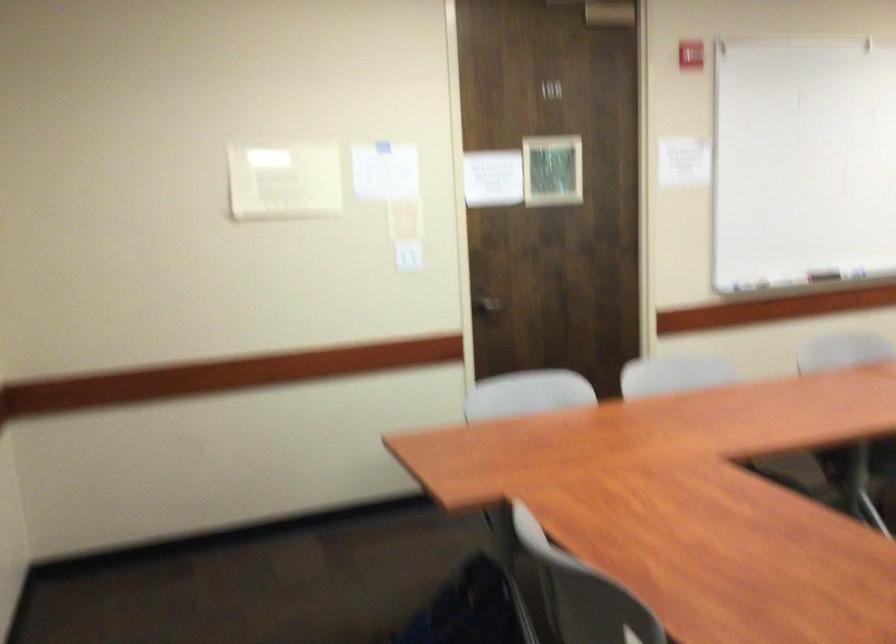
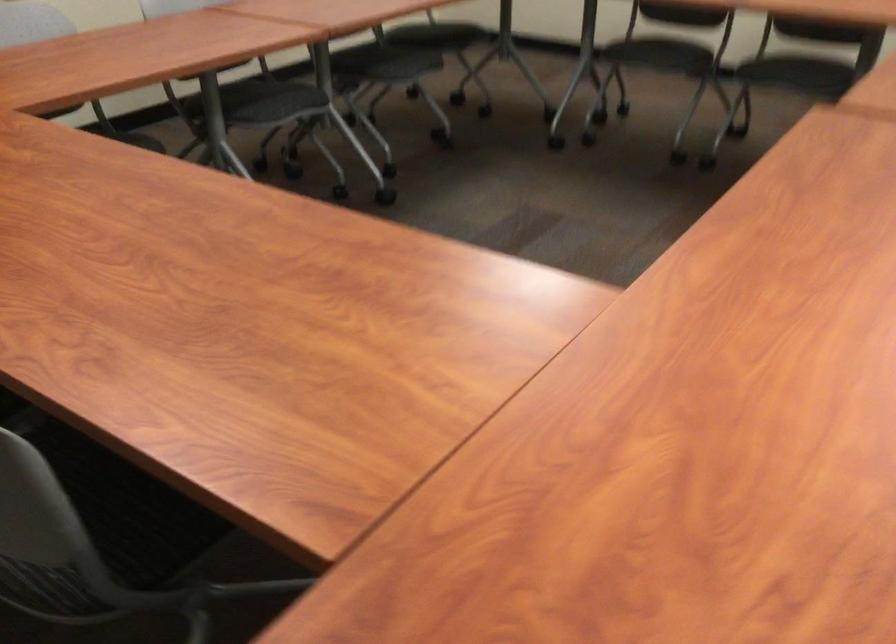
From the picture: The images are taken continuously from a first-person perspective. In which direction is your viewpoint rotating?

The camera rotated toward right-down.